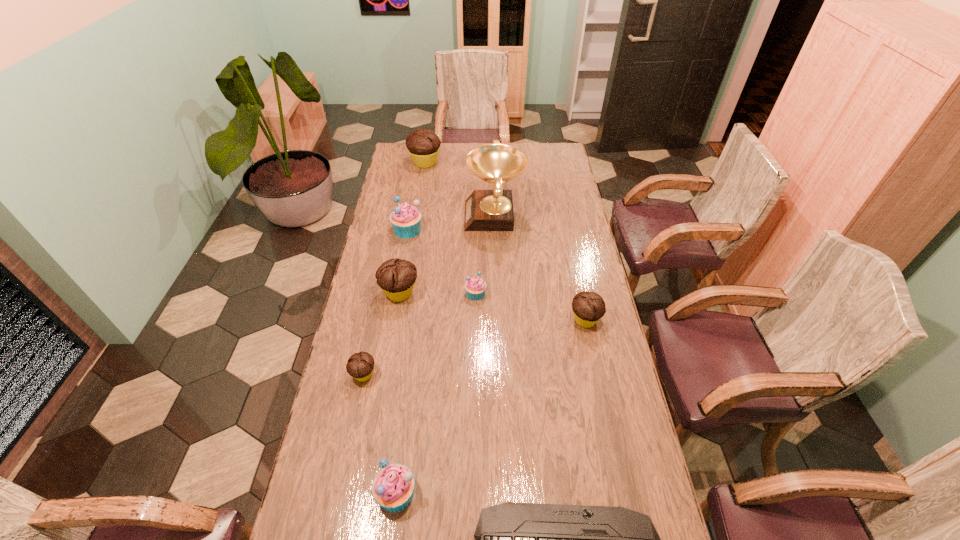
You are a GUI agent. You are given a task and a screenshot of the screen. Output one action in this format:
    pyautogui.click(x=<x>, y=<y>)
    Task: Click on the tallest object
    The height and width of the screenshot is (540, 960).
    Given the screenshot: What is the action you would take?
    pyautogui.click(x=485, y=210)

Locate an element on the screen. the farthest chocolate muffin is located at coordinates (423, 145).

At what (x,y) coordinates should I click in order to perform the action: click on the farthest muffin. Please return your answer as a coordinate pair (x, y). The image size is (960, 540). Looking at the image, I should click on (423, 145).

This screenshot has width=960, height=540. I want to click on the biggest blue muffin, so click(406, 219).

Find the location of a particular element. Image resolution: width=960 pixels, height=540 pixels. the sixth nearest muffin is located at coordinates (406, 219).

The width and height of the screenshot is (960, 540). Identify the location of the second biggest chocolate muffin. pyautogui.click(x=396, y=277).

Where is `the nearest blue muffin`? The height and width of the screenshot is (540, 960). the nearest blue muffin is located at coordinates (393, 487).

Where is `the nearest muffin`? The height and width of the screenshot is (540, 960). the nearest muffin is located at coordinates (393, 487).

You are a GUI agent. You are given a task and a screenshot of the screen. Output one action in this format:
    pyautogui.click(x=<x>, y=<y>)
    Task: Click on the second smallest chocolate muffin
    This screenshot has height=540, width=960.
    Given the screenshot: What is the action you would take?
    pyautogui.click(x=588, y=307)

Identify the location of the rightmost muffin. (588, 307).